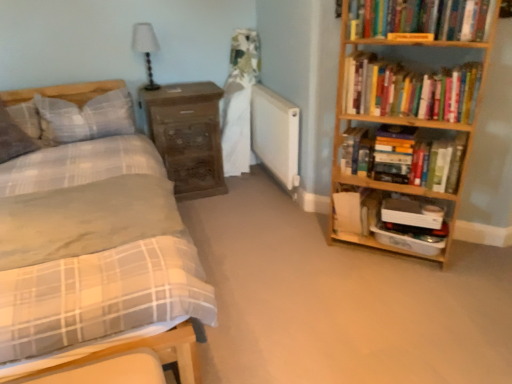
Find the location of a particular element. Image resolution: width=512 pixels, height=384 pixels. vacant area on top of white matte radiator at center (from a real-world perspective) is located at coordinates (276, 99).